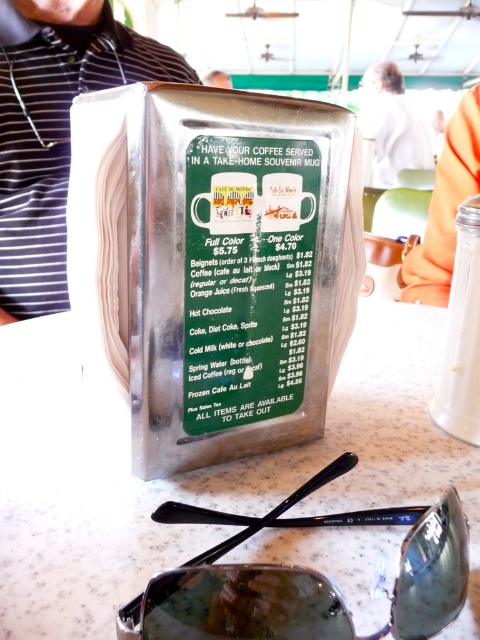
Question: Is white marble table at center further to the viewer compared to sunglasses at lower center?

Choices:
 (A) no
 (B) yes

Answer: (B)

Question: Which point is farther from the camera taking this photo?

Choices:
 (A) (248, 204)
 (B) (127, 500)

Answer: (A)

Question: Can you confirm if metallic green menu at center is wider than white fabric shirt at upper center?

Choices:
 (A) yes
 (B) no

Answer: (B)

Question: Considering the relative positions of sunglasses at lower center and white fabric shirt at upper center in the image provided, where is sunglasses at lower center located with respect to white fabric shirt at upper center?

Choices:
 (A) below
 (B) above

Answer: (A)

Question: Among these points, which one is nearest to the camera?

Choices:
 (A) (430, 625)
 (B) (262, 380)

Answer: (A)

Question: Which of the following is the closest to the observer?

Choices:
 (A) white fabric shirt at upper center
 (B) white marble table at center
 (C) sunglasses at lower center

Answer: (C)